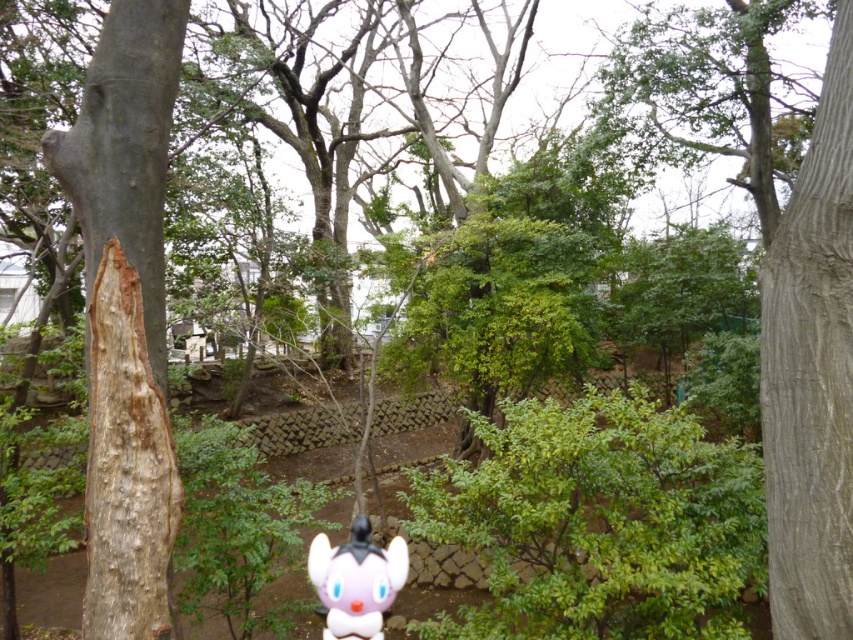
You are standing at the camera position and want to place a 1.5 meter long fence between you and the point at point (137, 358). Will the fence be long enough to reach from your position to the point?

The distance between the camera and the point (137, 358) is 2.70 meters. Since the fence is only 1.5 meters long, it will not be long enough to reach from your position to the point.

You are a photographer setting up a tripod in this park scene. You need to place the tripod between the gray textured tree trunk at right and the white glossy plush toy at center. Given that the tripod requires at least 1.2 meters of space between its legs to stabilize, can you fit it in the available space between these two objects?

The gray textured tree trunk at right is narrower than the white glossy plush toy at center. However, the exact distance between them isn

You are holding a camera and want to take a photo of the gray textured tree trunk at right. If you are standing 2.82 meters away from the tree trunk, is that within the camera lens range of 3 meters for clear focus?

The gray textured tree trunk at right and camera are 2.82 meters apart, so yes, it is within the 3 meters range for clear focus.